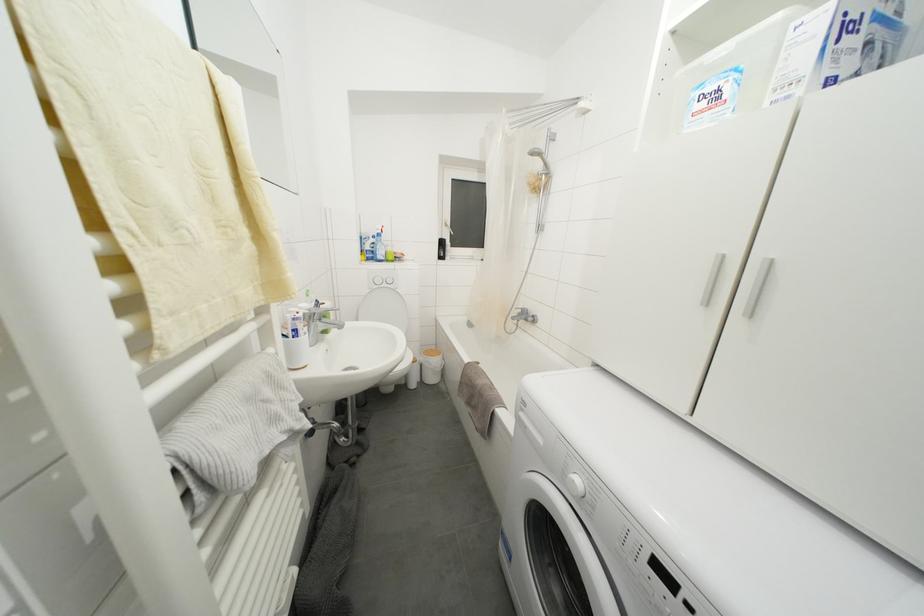
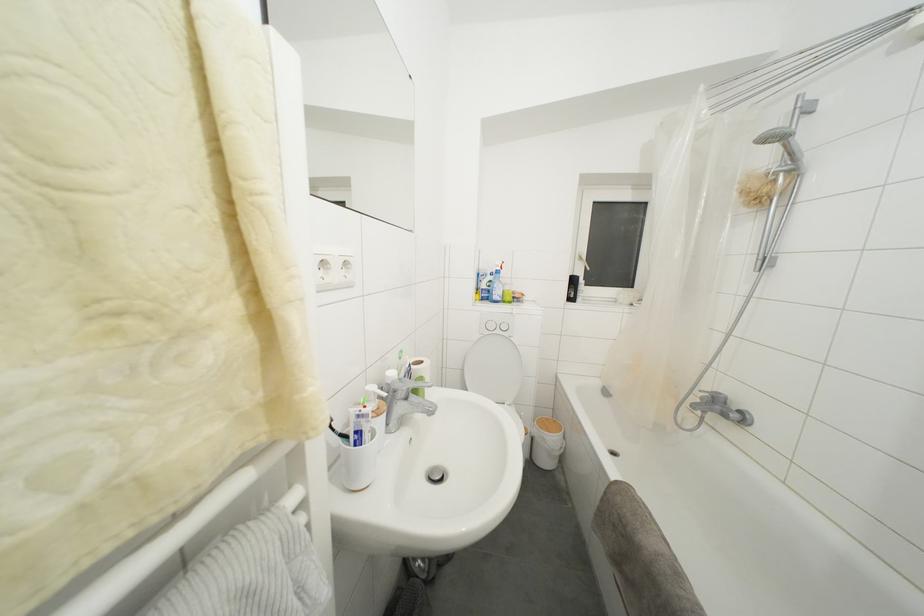
In the second image, find the point that corresponds to (550,168) in the first image.

(796, 159)